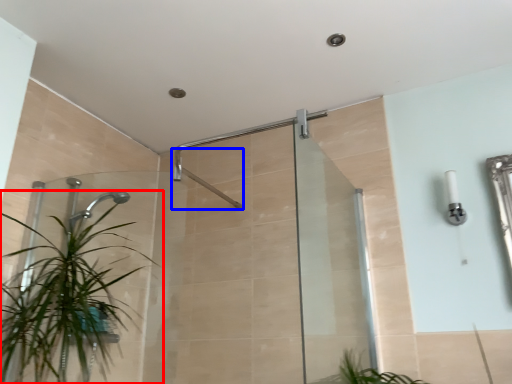
Question: Among these objects, which one is farthest to the camera, houseplant (highlighted by a red box) or shower (highlighted by a blue box)?

Choices:
 (A) houseplant
 (B) shower

Answer: (B)